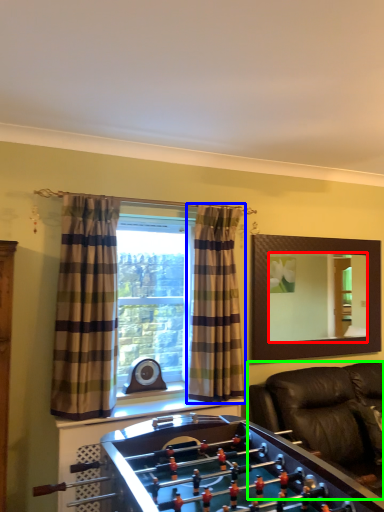
Question: Which object is positioned closest to mirror (highlighted by a red box)? Select from curtain (highlighted by a blue box) and studio couch (highlighted by a green box).

Choices:
 (A) curtain
 (B) studio couch

Answer: (B)